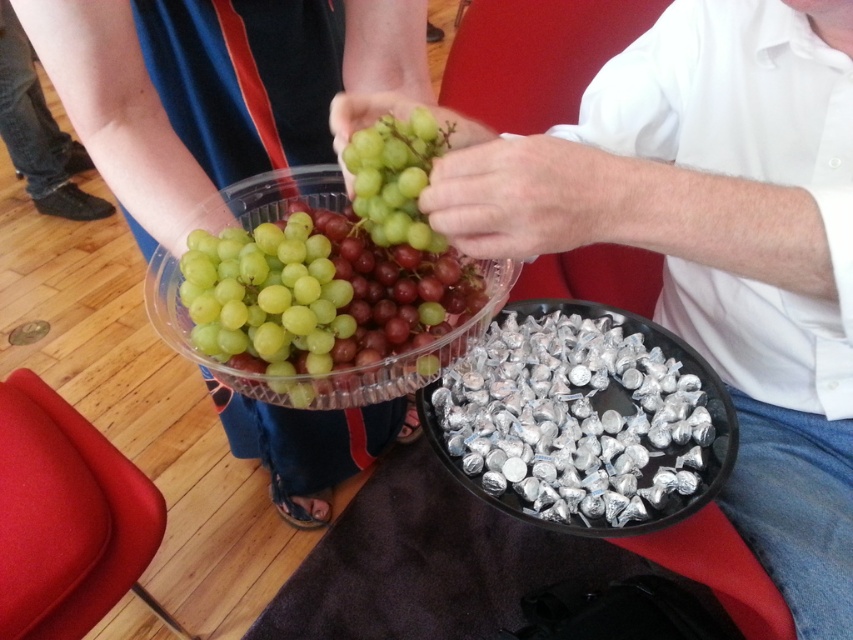
Question: Which of the following is the farthest from the observer?

Choices:
 (A) silver foil-wrapped chocolates at lower center
 (B) jeans at lower left
 (C) green matte grapes at center
 (D) green matte grapes at upper left

Answer: (B)

Question: Which of the following is the farthest from the observer?

Choices:
 (A) translucent plastic grapes at center
 (B) jeans at lower left
 (C) green matte grapes at center
 (D) green matte grapes at upper left

Answer: (B)

Question: Does green matte grapes at upper left have a larger size compared to translucent plastic grapes at center?

Choices:
 (A) yes
 (B) no

Answer: (A)

Question: Can you confirm if silver foil-wrapped chocolates at lower center is thinner than jeans at lower left?

Choices:
 (A) yes
 (B) no

Answer: (A)

Question: Does silver foil-wrapped chocolates at lower center have a smaller size compared to green matte grapes at center?

Choices:
 (A) yes
 (B) no

Answer: (B)

Question: Which object appears farthest from the camera in this image?

Choices:
 (A) jeans at lower left
 (B) silver foil-wrapped chocolates at lower center
 (C) green matte grapes at center

Answer: (A)